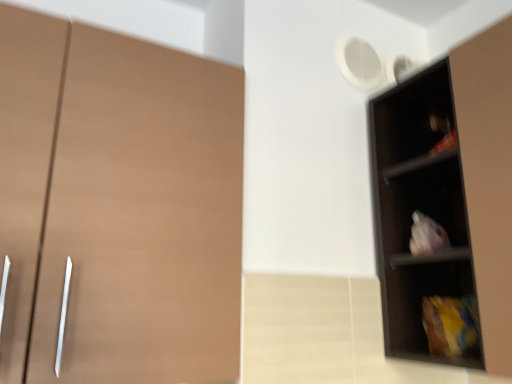
The width and height of the screenshot is (512, 384). I want to click on black matte shelf at right, so (422, 220).

This screenshot has height=384, width=512. What do you see at coordinates (422, 220) in the screenshot? I see `black matte shelf at right` at bounding box center [422, 220].

Describe the element at coordinates (117, 206) in the screenshot. Image resolution: width=512 pixels, height=384 pixels. I see `matte brown cupboard at left` at that location.

Find the location of a particular element. The image size is (512, 384). matte brown cupboard at left is located at coordinates (117, 206).

Where is `black matte shelf at right`? black matte shelf at right is located at coordinates (422, 220).

Is black matte shelf at right to the left or to the right of matte brown cupboard at left in the image?

Based on their positions, black matte shelf at right is located to the right of matte brown cupboard at left.

Between black matte shelf at right and matte brown cupboard at left, which one is positioned behind?

black matte shelf at right is further from the camera.

Is point (414, 213) positioned after point (54, 125)?

Yes, it is.

From the image's perspective, is black matte shelf at right located above or below matte brown cupboard at left?

black matte shelf at right is below matte brown cupboard at left.

From a real-world perspective, which object rests below the other?

In real-world perspective, matte brown cupboard at left is lower.

Which object is thinner, black matte shelf at right or matte brown cupboard at left?

Thinner between the two is black matte shelf at right.

Can you confirm if black matte shelf at right is shorter than matte brown cupboard at left?

In fact, black matte shelf at right may be taller than matte brown cupboard at left.

In the scene shown: Who is bigger, black matte shelf at right or matte brown cupboard at left?

With larger size is matte brown cupboard at left.

Could matte brown cupboard at left be considered to be inside black matte shelf at right?

No.

Is black matte shelf at right next to matte brown cupboard at left and touching it?

There is a gap between black matte shelf at right and matte brown cupboard at left.

Based on the photo, is black matte shelf at right aimed at matte brown cupboard at left?

Yes.

I want to click on cupboard that appears on the left of black matte shelf at right, so click(117, 206).

From the picture: Is matte brown cupboard at left at the left side of black matte shelf at right?

Yes, matte brown cupboard at left is to the left of black matte shelf at right.

Who is more distant, matte brown cupboard at left or black matte shelf at right?

black matte shelf at right is further from the camera.

Which is behind, point (238, 246) or point (473, 318)?

The point (473, 318) is more distant.

From the image's perspective, which is above, matte brown cupboard at left or black matte shelf at right?

From the image's view, matte brown cupboard at left is above.

From a real-world perspective, is matte brown cupboard at left located higher than black matte shelf at right?

No, from a real-world perspective, matte brown cupboard at left is not on top of black matte shelf at right.

Can you confirm if matte brown cupboard at left is thinner than black matte shelf at right?

No, matte brown cupboard at left is not thinner than black matte shelf at right.

Which of these two, matte brown cupboard at left or black matte shelf at right, stands shorter?

With less height is matte brown cupboard at left.

Looking at this image, between matte brown cupboard at left and black matte shelf at right, which one has larger size?

matte brown cupboard at left.

Is matte brown cupboard at left not inside black matte shelf at right?

Yes, matte brown cupboard at left is outside of black matte shelf at right.

Is matte brown cupboard at left not near black matte shelf at right?

No, matte brown cupboard at left is not far away from black matte shelf at right.

From the picture: Could you tell me if matte brown cupboard at left is facing black matte shelf at right?

No, matte brown cupboard at left is not aimed at black matte shelf at right.

Can you tell me how much matte brown cupboard at left and black matte shelf at right differ in facing direction?

The facing directions of matte brown cupboard at left and black matte shelf at right are 88.8 degrees apart.

I want to click on shelf on the right of matte brown cupboard at left, so click(422, 220).

Locate an element on the screen. This screenshot has width=512, height=384. cupboard on the left side of black matte shelf at right is located at coordinates (117, 206).

Where is `shelf above the matte brown cupboard at left (from a real-world perspective)`? Image resolution: width=512 pixels, height=384 pixels. shelf above the matte brown cupboard at left (from a real-world perspective) is located at coordinates (422, 220).